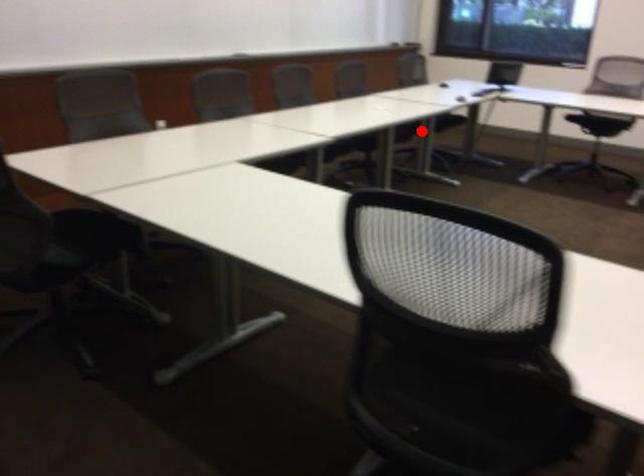
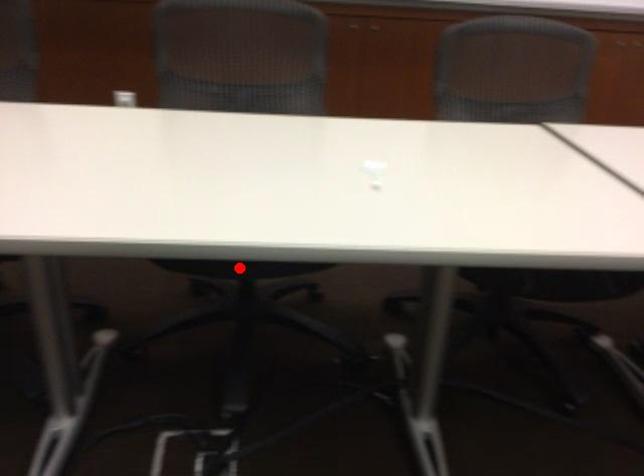
I am providing you with two images of the same scene from different viewpoints. A red point is marked on the first image and another point is marked on the second image. Are the points marked in image1 and image2 representing the same 3D position?

No